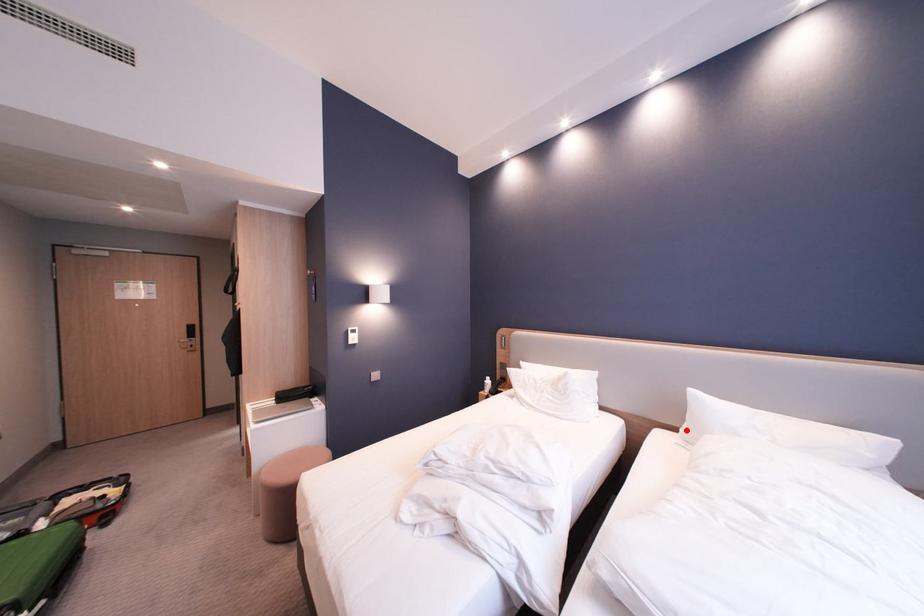
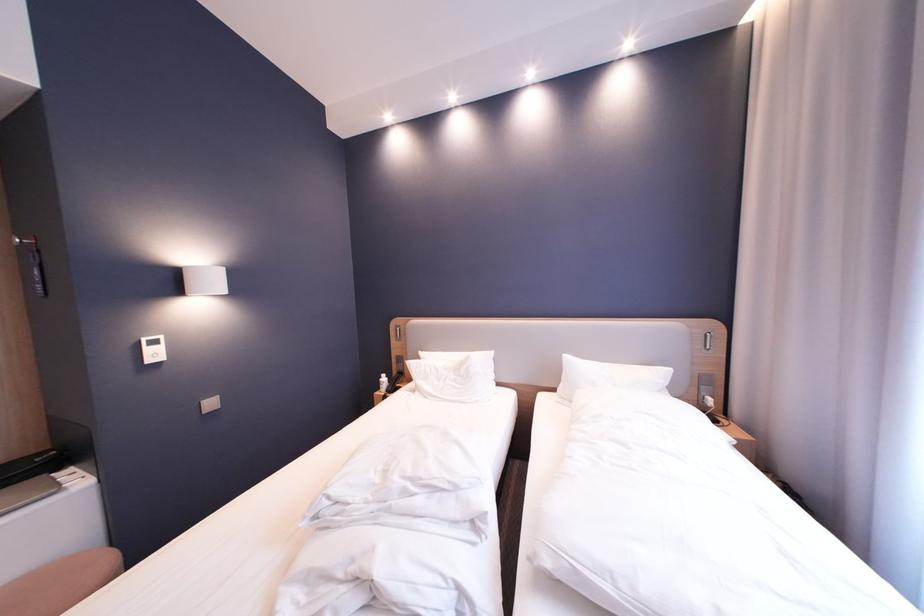
The point at the highlighted location is marked in the first image. Where is the corresponding point in the second image?

(565, 391)